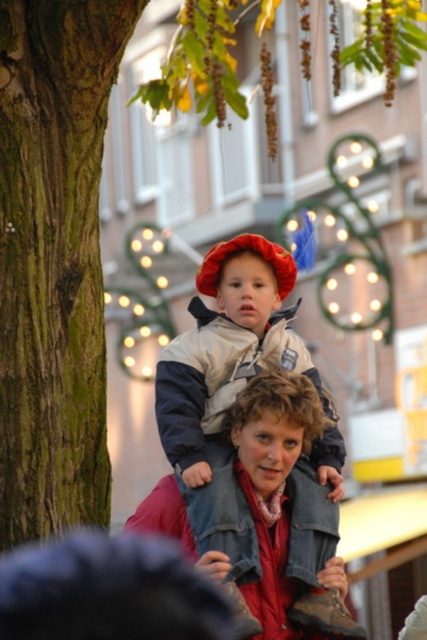
Question: Is matte blue jacket at center in front of gray fleece jacket at center?

Choices:
 (A) no
 (B) yes

Answer: (B)

Question: Which point appears closest to the camera in this image?

Choices:
 (A) (207, 620)
 (B) (161, 403)

Answer: (A)

Question: Considering the relative positions of black fuzzy hat at upper center and gray fleece jacket at center in the image provided, where is black fuzzy hat at upper center located with respect to gray fleece jacket at center?

Choices:
 (A) above
 (B) below

Answer: (B)

Question: Which point is closer to the camera taking this photo?

Choices:
 (A) (78, 560)
 (B) (216, 380)
 (C) (195, 435)

Answer: (A)

Question: Among these points, which one is farthest from the camera?

Choices:
 (A) (78, 621)
 (B) (233, 253)
 (C) (344, 456)

Answer: (B)

Question: Can you confirm if matte blue jacket at center is bigger than gray fleece jacket at center?

Choices:
 (A) no
 (B) yes

Answer: (B)